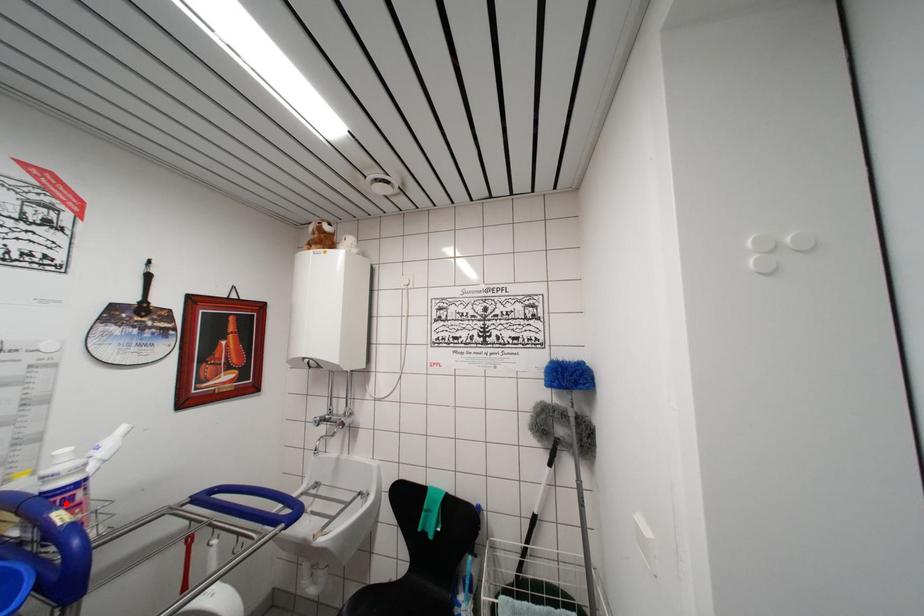
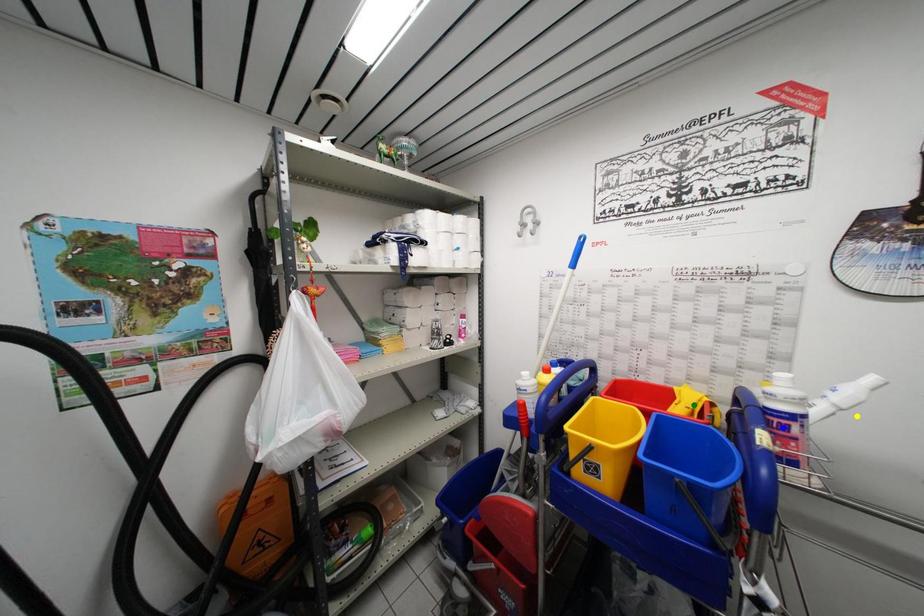
Question: I am providing you with two images of the same scene from different viewpoints. A red point is marked on the first image. You are given multiple points on the second image. Which spot in image 2 lines up with the point in image 1?

Choices:
 (A) blue point
 (B) green point
 (C) yellow point

Answer: (A)